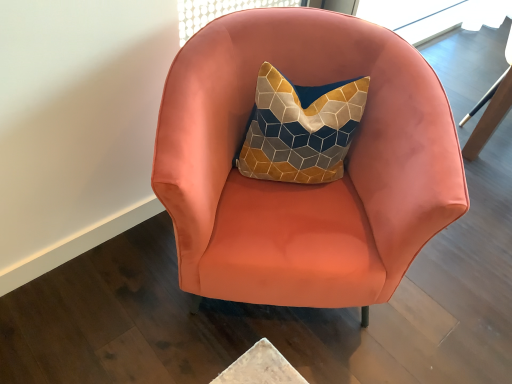
Question: Is satin coral armchair at center in front of or behind matte coral swivel chair at right in the image?

Choices:
 (A) behind
 (B) front

Answer: (B)

Question: Considering the positions of satin coral armchair at center and matte coral swivel chair at right in the image, is satin coral armchair at center bigger or smaller than matte coral swivel chair at right?

Choices:
 (A) big
 (B) small

Answer: (A)

Question: Is satin coral armchair at center situated inside matte coral swivel chair at right or outside?

Choices:
 (A) inside
 (B) outside

Answer: (B)

Question: In the image, is matte coral swivel chair at right positioned in front of or behind satin coral armchair at center?

Choices:
 (A) behind
 (B) front

Answer: (A)

Question: Considering the positions of matte coral swivel chair at right and satin coral armchair at center in the image, is matte coral swivel chair at right wider or thinner than satin coral armchair at center?

Choices:
 (A) thin
 (B) wide

Answer: (A)

Question: Is matte coral swivel chair at right bigger or smaller than satin coral armchair at center?

Choices:
 (A) big
 (B) small

Answer: (B)

Question: Considering the relative positions of matte coral swivel chair at right and satin coral armchair at center in the image provided, is matte coral swivel chair at right to the left or to the right of satin coral armchair at center?

Choices:
 (A) right
 (B) left

Answer: (A)